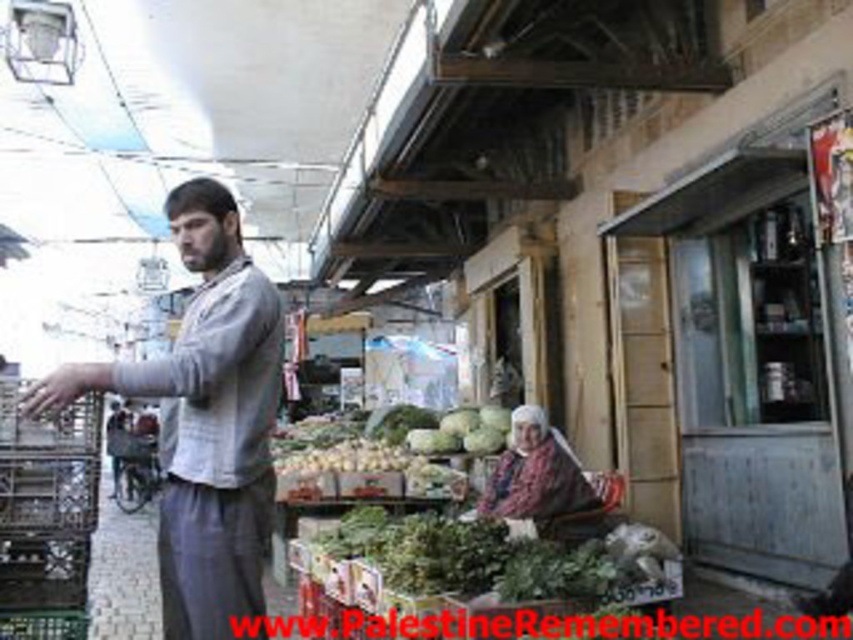
Can you confirm if brown plastic crate at left is taller than green matte cabbage at center?

Yes, brown plastic crate at left is taller than green matte cabbage at center.

Which is above, brown plastic crate at left or green matte cabbage at center?

brown plastic crate at left is above.

Is point (9, 632) farther from viewer compared to point (422, 435)?

No.

Locate an element on the screen. brown plastic crate at left is located at coordinates (45, 515).

Does floral fabric headscarf at center appear under green matte cabbage at center?

Indeed, floral fabric headscarf at center is positioned under green matte cabbage at center.

Who is higher up, floral fabric headscarf at center or green matte cabbage at center?

Positioned higher is green matte cabbage at center.

I want to click on floral fabric headscarf at center, so click(537, 474).

Which of these two, gray cotton shirt at center or green matte cabbage at center, stands shorter?

Answer: Standing shorter between the two is green matte cabbage at center.

Consider the image. Can you confirm if gray cotton shirt at center is positioned below green matte cabbage at center?

No.

Who is more distant from viewer, (225, 451) or (415, 442)?

The point (415, 442) is behind.

Image resolution: width=853 pixels, height=640 pixels. I want to click on gray cotton shirt at center, so click(x=204, y=419).